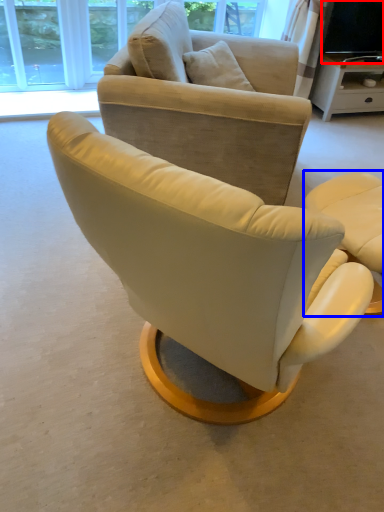
Question: Among these objects, which one is nearest to the camera, television (highlighted by a red box) or chair (highlighted by a blue box)?

Choices:
 (A) television
 (B) chair

Answer: (B)